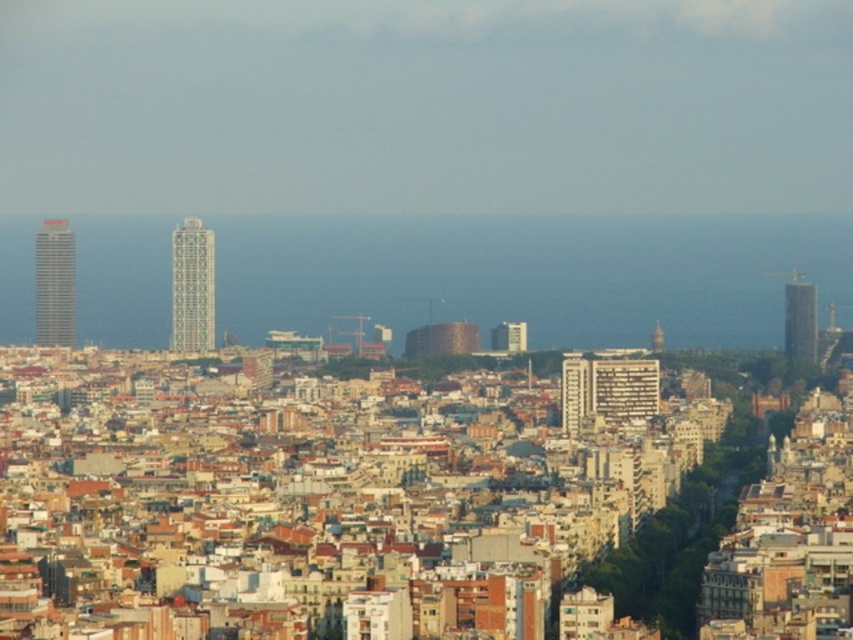
Which of these two, metallic glass tower at center or smooth glass skyscraper at center, stands taller?

With more height is metallic glass tower at center.

Which is behind, point (189, 253) or point (792, 323)?

The point (792, 323) is behind.

Where is `metallic glass tower at center`? metallic glass tower at center is located at coordinates (192, 285).

Is matte glass skyscraper at left to the right of smooth glass skyscraper at center from the viewer's perspective?

In fact, matte glass skyscraper at left is to the left of smooth glass skyscraper at center.

Looking at this image, which of these two, matte glass skyscraper at left or smooth glass skyscraper at center, stands taller?

With more height is matte glass skyscraper at left.

Describe the element at coordinates (54, 284) in the screenshot. The height and width of the screenshot is (640, 853). I see `matte glass skyscraper at left` at that location.

The image size is (853, 640). I want to click on matte glass skyscraper at left, so click(x=54, y=284).

From the picture: Between smooth glass skyscraper at center and matte white building at center, which one is positioned lower?

Positioned lower is matte white building at center.

Who is higher up, smooth glass skyscraper at center or matte white building at center?

Positioned higher is smooth glass skyscraper at center.

Between point (788, 282) and point (494, 348), which one is positioned in front?

Positioned in front is point (494, 348).

At what (x,y) coordinates should I click in order to perform the action: click on smooth glass skyscraper at center. Please return your answer as a coordinate pair (x, y). This screenshot has width=853, height=640. Looking at the image, I should click on (799, 317).